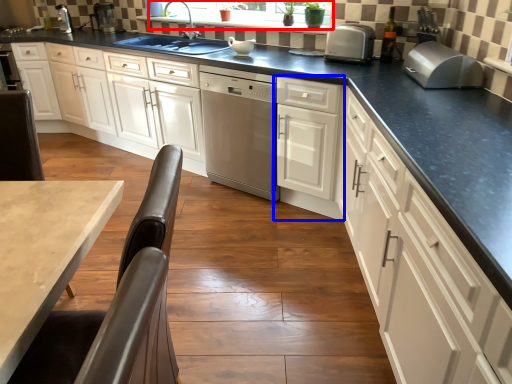
Question: Which object appears farthest to the camera in this image, window screen (highlighted by a red box) or cabinetry (highlighted by a blue box)?

Choices:
 (A) window screen
 (B) cabinetry

Answer: (A)